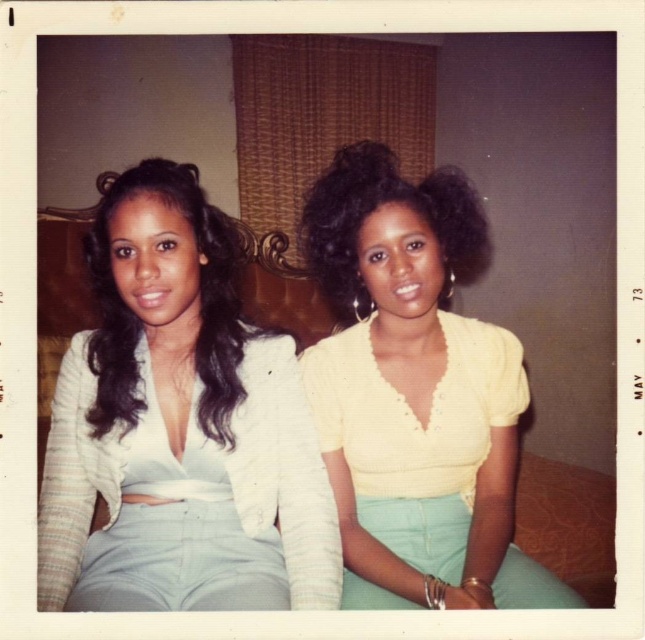
You are a fashion designer observing this vintage image. You notice the yellow knitted top at center and the black silky hair at left. Which item is located to the right of the other?

The yellow knitted top at center is positioned on the right side of black silky hair at left.

You are an interior designer observing the vintage photograph. You notice the white textured blouse at left and the yellow knitted top at center. Which clothing item is positioned higher in the image?

The white textured blouse at left is located above the yellow knitted top at center, so it is positioned higher in the image.